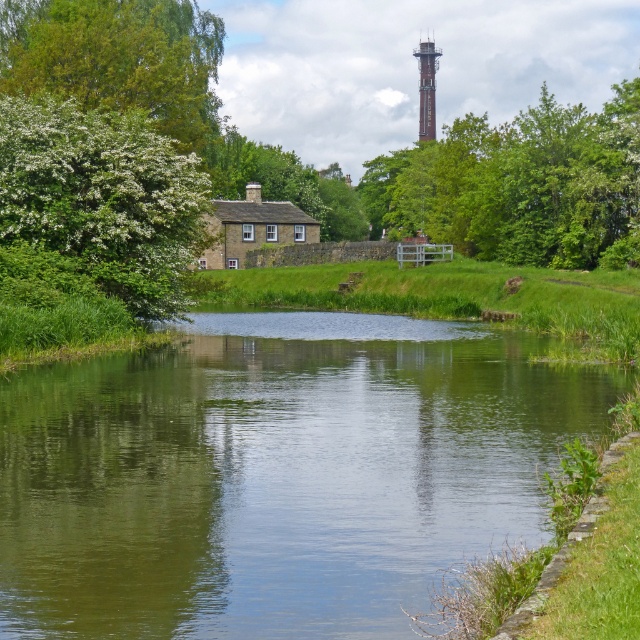
Question: Among these points, which one is nearest to the camera?

Choices:
 (A) (547, 125)
 (B) (221, 461)

Answer: (B)

Question: Which object is the closest to the brick tower at upper center?

Choices:
 (A) green smooth water at center
 (B) white blossoming bush at left

Answer: (B)

Question: Is green smooth water at center to the left of white blossoming bush at left from the viewer's perspective?

Choices:
 (A) no
 (B) yes

Answer: (A)

Question: Can you confirm if green leafy tree at upper center is positioned below brick tower at upper center?

Choices:
 (A) yes
 (B) no

Answer: (A)

Question: Estimate the real-world distances between objects in this image. Which object is farther from the green smooth water at center?

Choices:
 (A) white blossoming bush at left
 (B) green leafy tree at upper center
 (C) brick tower at upper center

Answer: (C)

Question: Is the position of green smooth water at center more distant than that of green leafy tree at upper center?

Choices:
 (A) yes
 (B) no

Answer: (B)